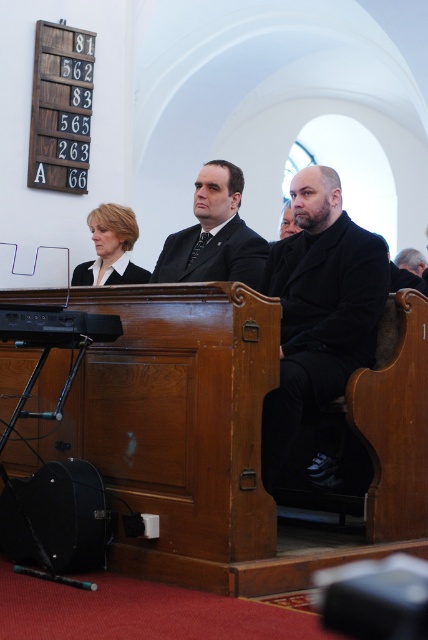
Does point (321, 332) come in front of point (237, 227)?

Yes, point (321, 332) is in front of point (237, 227).

Which is behind, point (273, 408) or point (162, 262)?

The point (162, 262) is more distant.

Identify the location of black matte coat at center. [x=318, y=308].

Does black matte suit at center have a lesser height compared to black matte business suit at center?

No.

Is black matte suit at center wider than black matte business suit at center?

Yes, black matte suit at center is wider than black matte business suit at center.

Which is behind, point (213, 182) or point (95, 262)?

The point (95, 262) is more distant.

The image size is (428, 640). I want to click on black matte suit at center, so point(214,234).

Is matte black suit at center to the left of black matte business suit at center from the viewer's perspective?

Incorrect, matte black suit at center is not on the left side of black matte business suit at center.

Between matte black suit at center and black matte business suit at center, which one appears on the right side from the viewer's perspective?

From the viewer's perspective, matte black suit at center appears more on the right side.

Which is behind, point (125, 232) or point (73, 280)?

The point (73, 280) is more distant.

Where is `matte black suit at center`? This screenshot has height=640, width=428. matte black suit at center is located at coordinates (110, 248).